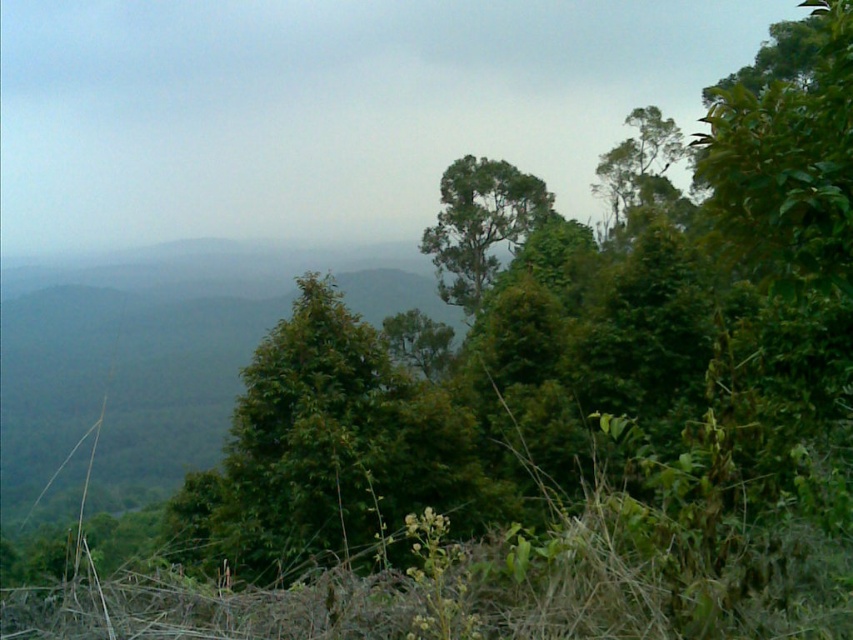
You are standing in a lush forest and see two points marked in the scene. The first point is at coordinate point (457, 212) and the second is at point (631, 198). Which point is nearer to you?

Point (457, 212) is closer to the viewer than point (631, 198).

You are standing at the origin point of the coordinate system in the image. The origin is at the bottom left corner of the image. The coordinate system has a horizontal axis from 0 to 1 and a vertical axis from 0 to 1. You want to walk towards the green leafy tree at center. In which direction should you move first? Please answer with either left, right, forward, or backward.

The green leafy tree at center is located at coordinate point 0.350 on the horizontal axis and 0.563 on the vertical axis. Since the origin is at the bottom left corner, moving forward would increase the vertical coordinate. To reach the tree, you should first move forward because the vertical coordinate 0.563 is higher than the origin at 0.0. Moving forward aligns with increasing the vertical position towards the tree.

Based on the photo, you are an environmental scientist studying the forest structure. You observe two trees in the image, the green leafy tree at center and the green leafy tree at upper right. Which tree would cast a longer shadow during midday when the sun is directly overhead?

The green leafy tree at upper right is taller than the green leafy tree at center, so it would cast a longer shadow during midday when the sun is directly overhead.